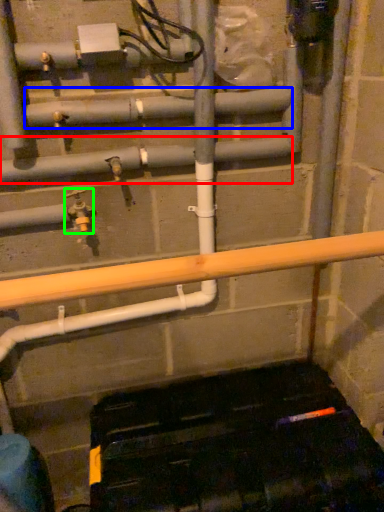
Question: Which is farther away from pipe (highlighted by a red box)? pipe (highlighted by a blue box) or plumbing fixture (highlighted by a green box)?

Choices:
 (A) pipe
 (B) plumbing fixture

Answer: (B)